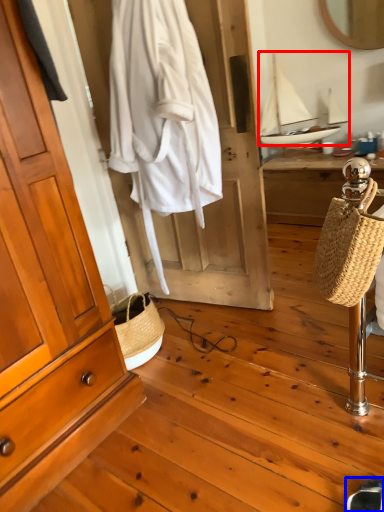
Question: Which point is closer to the camera, sailboat (highlighted by a red box) or shoe (highlighted by a blue box)?

Choices:
 (A) sailboat
 (B) shoe

Answer: (B)